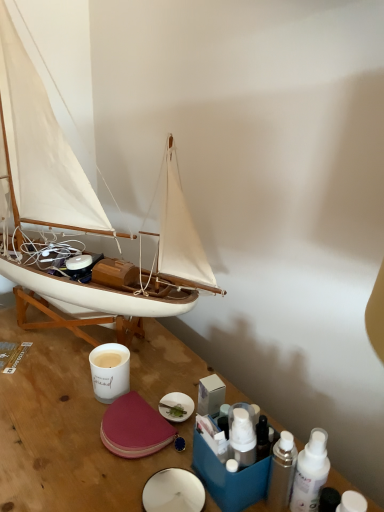
At what (x,y) coordinates should I click in order to perform the action: click on free space behind white matte cup at center. Please return your answer as a coordinate pair (x, y). This screenshot has width=384, height=512. Looking at the image, I should click on (125, 346).